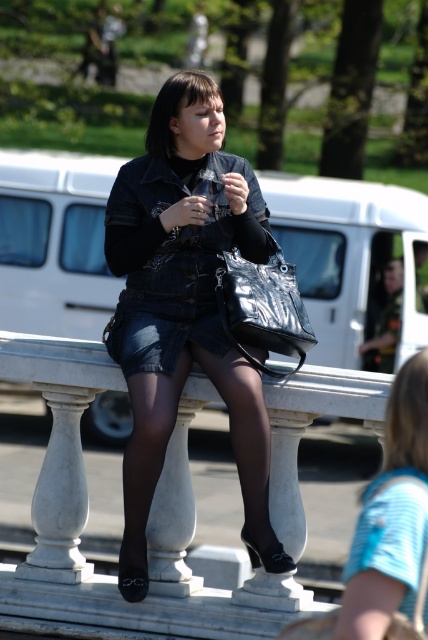
Question: Which of the following is the closest to the observer?

Choices:
 (A) (347, 262)
 (B) (243, 260)
 (C) (130, 248)
 (D) (386, 595)

Answer: (D)

Question: Observing the image, what is the correct spatial positioning of denim skirt at center in reference to denim skirt at lower right?

Choices:
 (A) right
 (B) left

Answer: (B)

Question: Is white matte van at upper center to the right of denim shorts at center from the viewer's perspective?

Choices:
 (A) yes
 (B) no

Answer: (A)

Question: Is denim skirt at center further to the viewer compared to denim skirt at lower right?

Choices:
 (A) no
 (B) yes

Answer: (B)

Question: Which object is farther from the camera taking this photo?

Choices:
 (A) metallic black handbag at center
 (B) black tights at center
 (C) denim shorts at center

Answer: (C)

Question: Among these points, which one is farthest from the camera?

Choices:
 (A) (350, 636)
 (B) (261, 342)
 (C) (172, 323)

Answer: (C)